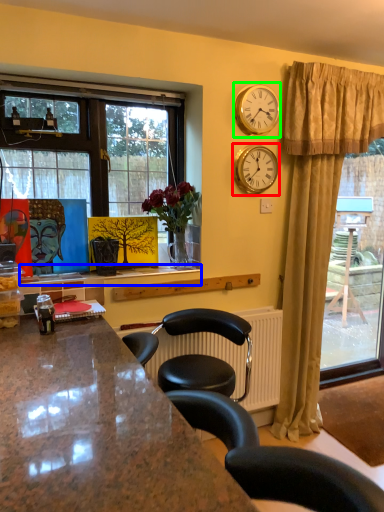
Question: Considering the real-world distances, which object is farthest from clock (highlighted by a red box)? window sill (highlighted by a blue box) or clock (highlighted by a green box)?

Choices:
 (A) window sill
 (B) clock

Answer: (A)